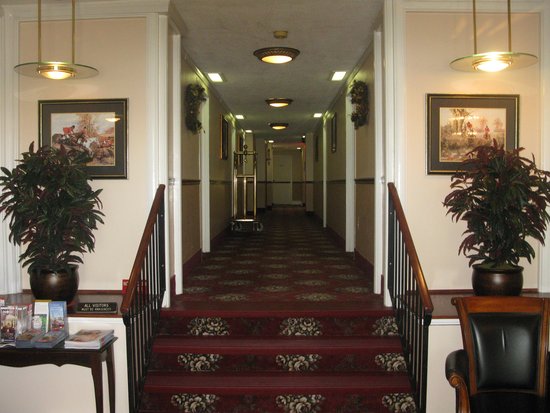
Find the location of `hand rail`. hand rail is located at coordinates (414, 248), (139, 251).